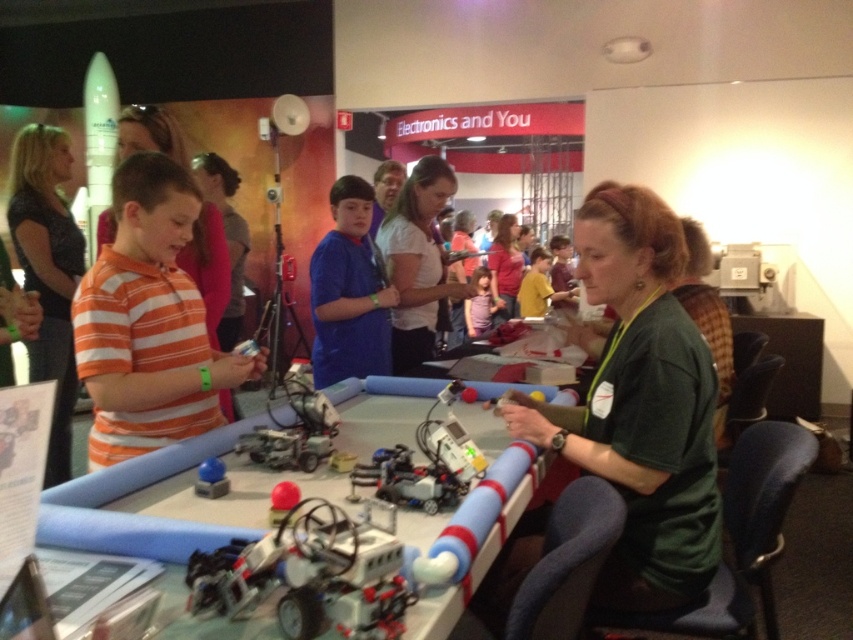
Question: Which point is farther to the camera?

Choices:
 (A) white matte shirt at center
 (B) matte green shirt at center
 (C) dark speckled shirt at upper left
 (D) matte blue button at lower left

Answer: (B)

Question: Which object appears closest to the camera in this image?

Choices:
 (A) metallic silver robot at center
 (B) white matte shirt at center

Answer: (A)

Question: Among these objects, which one is nearest to the camera?

Choices:
 (A) dark speckled shirt at upper left
 (B) rubberized red ball at center
 (C) white matte shirt at center

Answer: (B)

Question: Does matte blue button at lower left have a larger size compared to rubberized red ball at center?

Choices:
 (A) yes
 (B) no

Answer: (B)

Question: Is matte blue button at lower left below rubberized red ball at center?

Choices:
 (A) no
 (B) yes

Answer: (A)

Question: Does dark speckled shirt at upper left appear over matte green shirt at center?

Choices:
 (A) yes
 (B) no

Answer: (B)